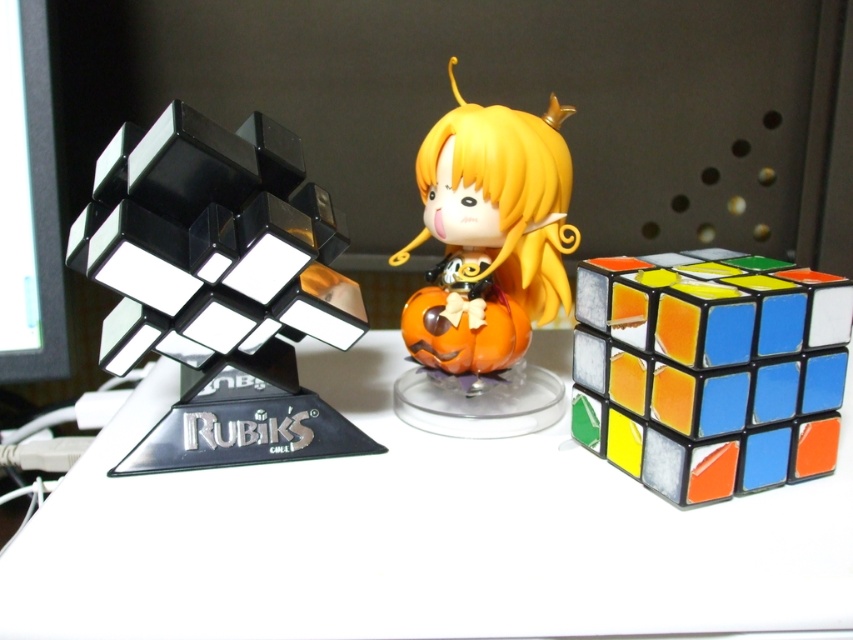
Question: Is white glossy table at center wider than transparent plastic rubik's cube at left?

Choices:
 (A) no
 (B) yes

Answer: (B)

Question: Among these points, which one is nearest to the camera?

Choices:
 (A) (495, 474)
 (B) (805, 416)
 (C) (460, 371)

Answer: (B)

Question: Which object is farther from the camera taking this photo?

Choices:
 (A) rubik's cube at center
 (B) transparent plastic rubik's cube at left
 (C) white glossy table at center
 (D) orange matte pumpkin at center

Answer: (D)

Question: Does rubik's cube at center have a lesser width compared to orange matte pumpkin at center?

Choices:
 (A) no
 (B) yes

Answer: (A)

Question: Among these objects, which one is farthest from the camera?

Choices:
 (A) rubik's cube at center
 (B) white glossy table at center

Answer: (A)

Question: In this image, where is white glossy table at center located relative to orange matte pumpkin at center?

Choices:
 (A) below
 (B) above

Answer: (A)